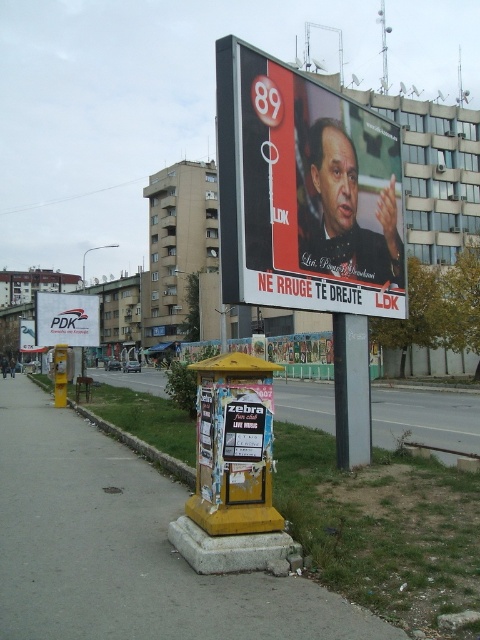
Who is more distant from viewer, (384,419) or (344,422)?

Point (384,419)

Is point (414, 403) behind point (370, 440)?

That is True.

The image size is (480, 640). What do you see at coordinates (425, 417) in the screenshot? I see `yellow painted concrete at lower center` at bounding box center [425, 417].

Where is `yellow painted concrete at lower center`? This screenshot has height=640, width=480. yellow painted concrete at lower center is located at coordinates (425, 417).

Find the location of a particular element. The height and width of the screenshot is (640, 480). white plastic billboard at center is located at coordinates (67, 320).

Who is higher up, white plastic billboard at center or green grass at lower left?

white plastic billboard at center is above.

The height and width of the screenshot is (640, 480). What do you see at coordinates (67, 320) in the screenshot?
I see `white plastic billboard at center` at bounding box center [67, 320].

In order to click on white plastic billboard at center in this screenshot , I will do `click(67, 320)`.

Does matte black poster at center have a greater height compared to white plastic billboard at center?

Correct, matte black poster at center is much taller as white plastic billboard at center.

Find the location of `matte black poster at center`. matte black poster at center is located at coordinates click(304, 192).

Is point (398, 291) positioned behind point (86, 314)?

No, (398, 291) is in front of (86, 314).

I want to click on matte black poster at center, so click(304, 192).